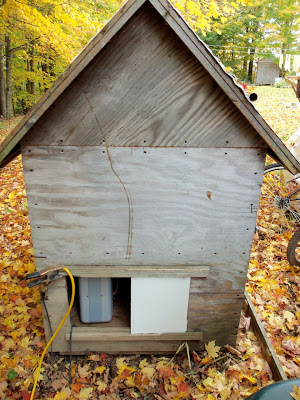
At what (x,y) coordinates should I click in order to perform the action: click on access panel. Please return your answer as a coordinate pair (x, y). This screenshot has width=300, height=400. Looking at the image, I should click on (149, 305).